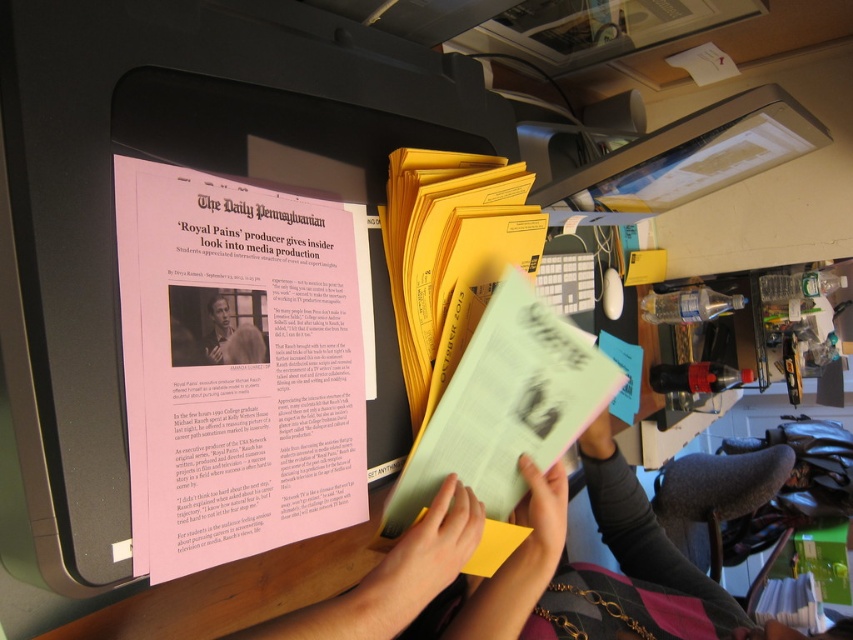
Question: Which point appears farthest from the camera in this image?

Choices:
 (A) (566, 340)
 (B) (253, 358)

Answer: (A)

Question: Where is matte black monitor at center located in relation to smooth skin portrait at center in the image?

Choices:
 (A) right
 (B) left

Answer: (A)

Question: Which point is closer to the camera?

Choices:
 (A) light green paper at center
 (B) yellow paper at center
 (C) pink paper at center
 (D) smooth skin portrait at center

Answer: (C)

Question: Which point is farther to the camera?

Choices:
 (A) (228, 316)
 (B) (450, 273)

Answer: (B)

Question: In this image, where is pink paper at center located relative to yellow paper at center?

Choices:
 (A) left
 (B) right

Answer: (A)

Question: Can you confirm if matte black monitor at center is positioned below pink paper at center?

Choices:
 (A) yes
 (B) no

Answer: (B)